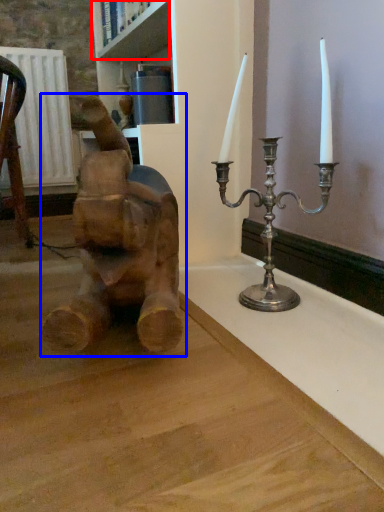
Question: Which point is further to the camera, shelf (highlighted by a red box) or statue (sculpture) (highlighted by a blue box)?

Choices:
 (A) shelf
 (B) statue (sculpture)

Answer: (A)